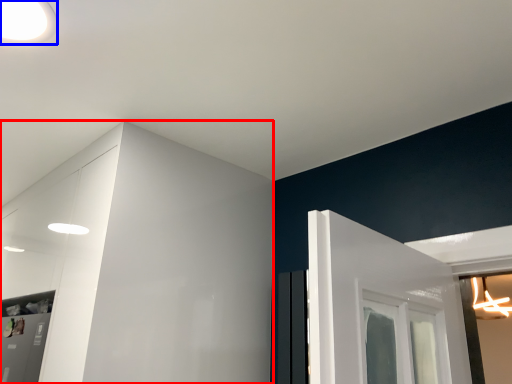
Question: Which object is further to the camera taking this photo, dresser (highlighted by a red box) or light (highlighted by a blue box)?

Choices:
 (A) dresser
 (B) light

Answer: (A)